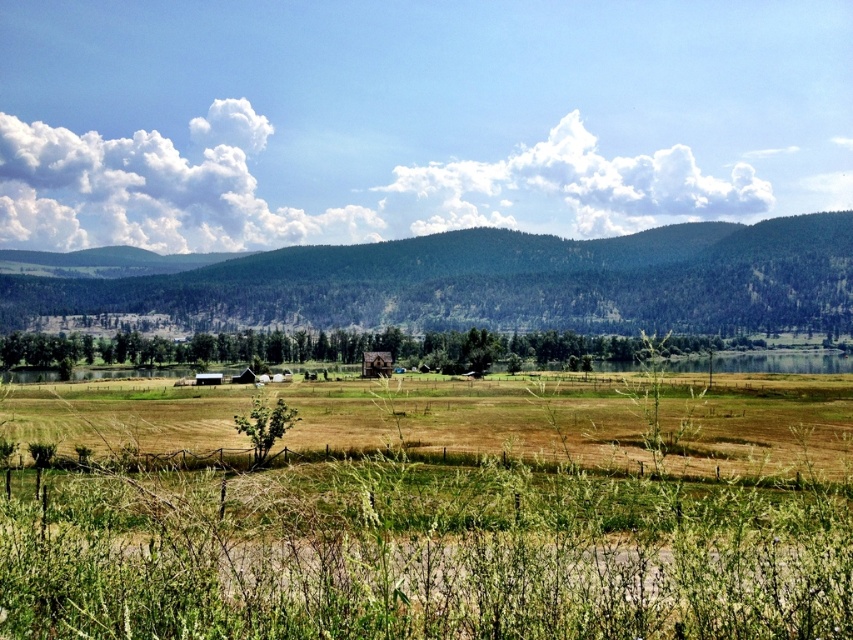
You are standing at a point in the rural landscape and see two points marked in the image. If you were to walk towards the point labeled point [695,595], would you pass by the point labeled point [390,358] first?

Point [695,595] is in front of point [390,358], so if you walk towards point [695,595], you would not pass by point [390,358] first. The point [390,358] is behind point [695,595] from your perspective.

You are standing at the point marked as point (x=425, y=556) in the image. What is the color of the ground beneath your feet?

The ground beneath your feet at point (x=425, y=556) is green grass at center.